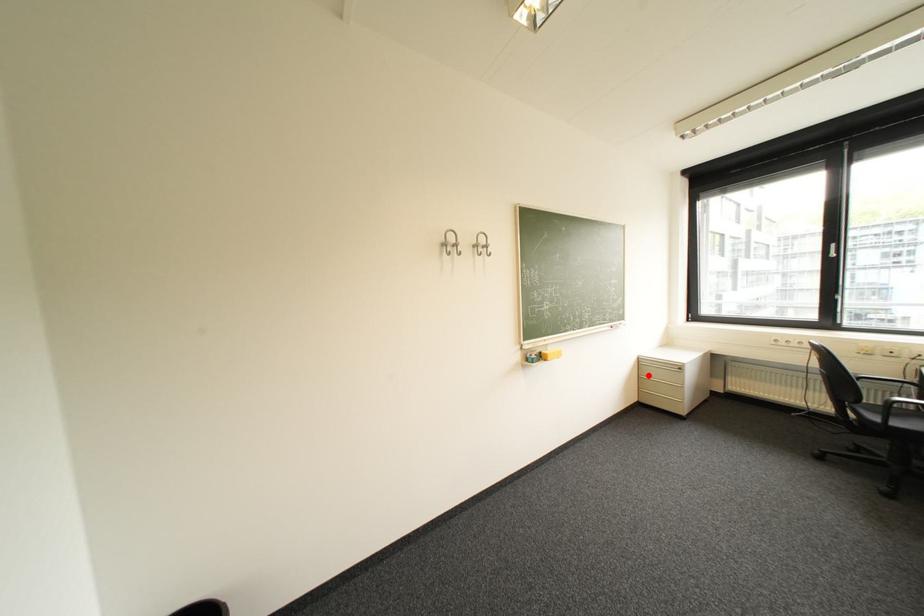
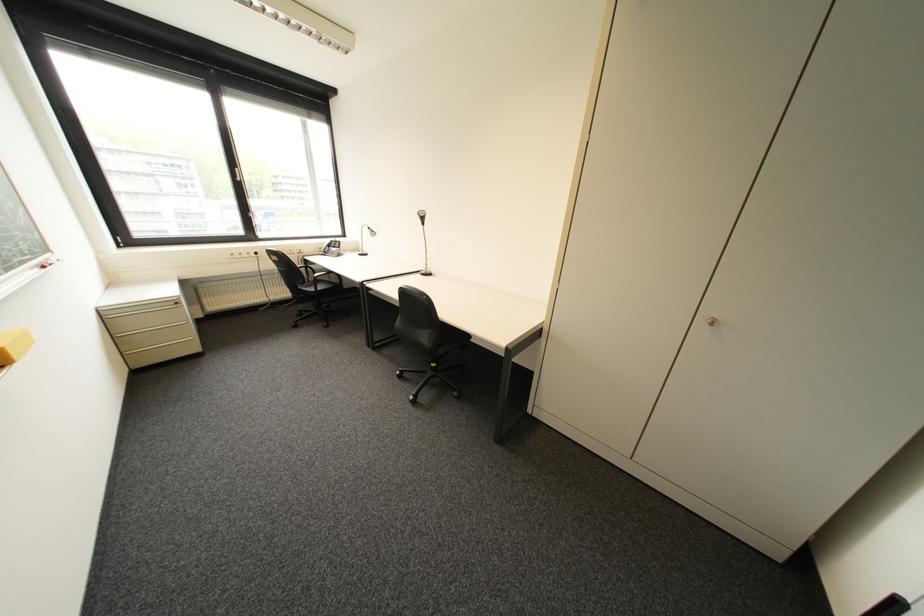
Question: I am providing you with two images of the same scene from different viewpoints. Given a red point in image1, look at the same physical point in image2. Is it:

Choices:
 (A) Closer to the viewpoint
 (B) Farther from the viewpoint

Answer: (A)